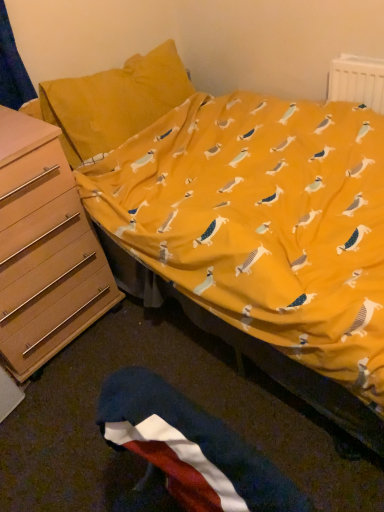
Question: Can you confirm if light brown wooden chest of drawers at left is positioned to the right of polyester flag at lower center?

Choices:
 (A) yes
 (B) no

Answer: (B)

Question: Is light brown wooden chest of drawers at left turned away from polyester flag at lower center?

Choices:
 (A) no
 (B) yes

Answer: (A)

Question: Is light brown wooden chest of drawers at left bigger than polyester flag at lower center?

Choices:
 (A) no
 (B) yes

Answer: (B)

Question: Does light brown wooden chest of drawers at left have a greater width compared to polyester flag at lower center?

Choices:
 (A) yes
 (B) no

Answer: (A)

Question: Is light brown wooden chest of drawers at left surrounding polyester flag at lower center?

Choices:
 (A) yes
 (B) no

Answer: (B)

Question: Based on their positions, is white plastic radiator at upper right located to the left or right of light brown wooden chest of drawers at left?

Choices:
 (A) right
 (B) left

Answer: (A)

Question: Is white plastic radiator at upper right wider or thinner than light brown wooden chest of drawers at left?

Choices:
 (A) wide
 (B) thin

Answer: (B)

Question: From the image's perspective, relative to light brown wooden chest of drawers at left, is white plastic radiator at upper right above or below?

Choices:
 (A) above
 (B) below

Answer: (A)

Question: From a real-world perspective, is white plastic radiator at upper right above or below light brown wooden chest of drawers at left?

Choices:
 (A) below
 (B) above

Answer: (B)

Question: From the image's perspective, is light brown wooden chest of drawers at left above or below white plastic radiator at upper right?

Choices:
 (A) above
 (B) below

Answer: (B)

Question: Considering the relative positions of light brown wooden chest of drawers at left and white plastic radiator at upper right in the image provided, is light brown wooden chest of drawers at left to the left or to the right of white plastic radiator at upper right?

Choices:
 (A) left
 (B) right

Answer: (A)

Question: Is light brown wooden chest of drawers at left taller or shorter than white plastic radiator at upper right?

Choices:
 (A) short
 (B) tall

Answer: (B)

Question: Considering their positions, is light brown wooden chest of drawers at left located in front of or behind white plastic radiator at upper right?

Choices:
 (A) front
 (B) behind

Answer: (A)

Question: In the image, is light brown wooden chest of drawers at left positioned in front of or behind polyester flag at lower center?

Choices:
 (A) behind
 (B) front

Answer: (A)

Question: Considering the positions of light brown wooden chest of drawers at left and polyester flag at lower center in the image, is light brown wooden chest of drawers at left wider or thinner than polyester flag at lower center?

Choices:
 (A) wide
 (B) thin

Answer: (A)